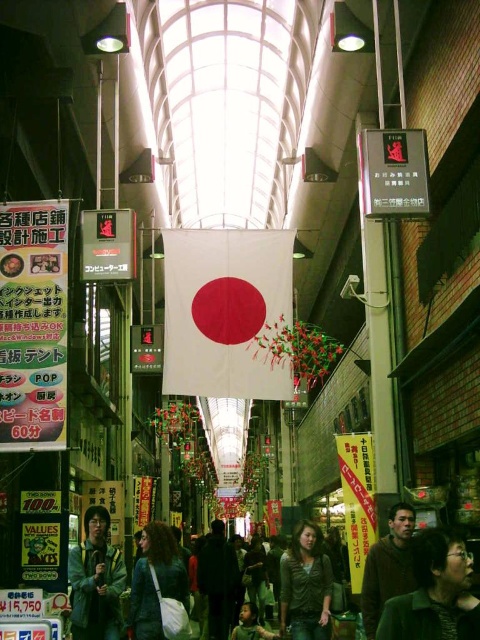
Question: Can you confirm if dark brown sweater at lower right is thinner than green denim jacket at lower left?

Choices:
 (A) yes
 (B) no

Answer: (A)

Question: Estimate the real-world distances between objects in this image. Which object is farther from the brown fuzzy sweater at center?

Choices:
 (A) dark gray fabric coat at center
 (B) white paper sign at left

Answer: (A)

Question: Which point is farther to the camera?

Choices:
 (A) dark brown sweater at lower right
 (B) brown fuzzy sweater at center

Answer: (B)

Question: Can you confirm if brown fuzzy sweater at center is wider than dark gray fabric coat at center?

Choices:
 (A) no
 (B) yes

Answer: (A)

Question: Which object is positioned closest to the dark brown sweater at lower right?

Choices:
 (A) white paper sign at left
 (B) dark green textured sweater at center

Answer: (B)

Question: Can you confirm if green denim jacket at lower left is positioned to the right of green fabric shirt at center?

Choices:
 (A) yes
 (B) no

Answer: (B)